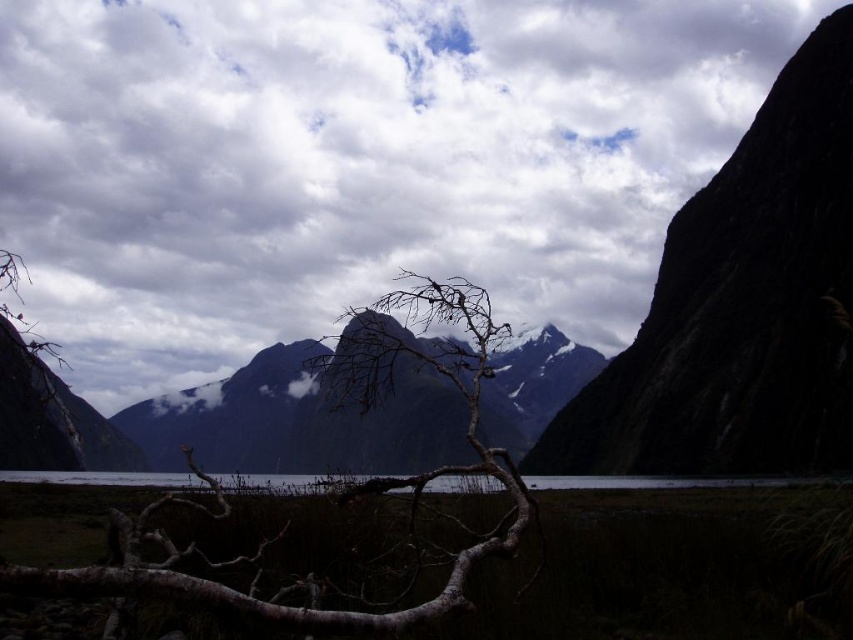
Question: Is black rock mountain at right wider than clear water at center?

Choices:
 (A) no
 (B) yes

Answer: (A)

Question: Can you confirm if brown rough tree at center is smaller than clear water at center?

Choices:
 (A) no
 (B) yes

Answer: (B)

Question: Which of the following is the closest to the observer?

Choices:
 (A) (704, 84)
 (B) (671, 422)
 (C) (358, 460)
 (D) (691, 481)

Answer: (D)

Question: Estimate the real-world distances between objects in this image. Which object is farther from the clear water at center?

Choices:
 (A) dark gray rocky mountain at center
 (B) brown rough tree at center
 (C) cloudy sky at upper center
 (D) black rock mountain at right

Answer: (C)

Question: Is cloudy sky at upper center wider than clear water at center?

Choices:
 (A) yes
 (B) no

Answer: (A)

Question: Estimate the real-world distances between objects in this image. Which object is farther from the black rock mountain at right?

Choices:
 (A) dark gray rocky mountain at center
 (B) clear water at center
 (C) brown rough tree at center
 (D) cloudy sky at upper center

Answer: (A)